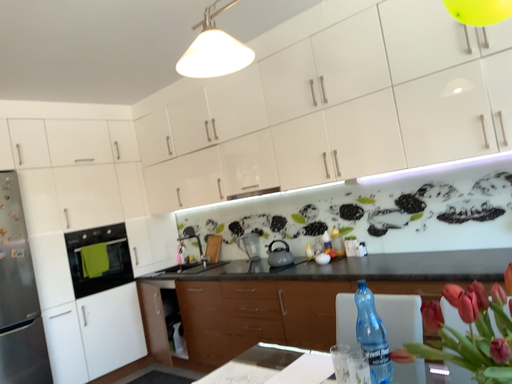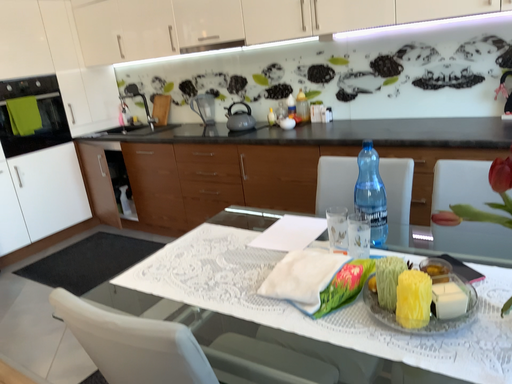
Question: How did the camera likely rotate when shooting the video?

Choices:
 (A) rotated right
 (B) rotated left

Answer: (A)